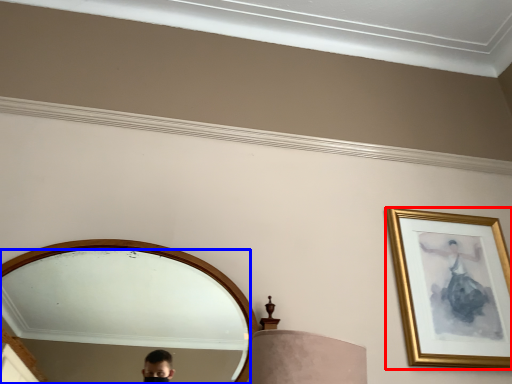
Question: Which object appears closest to the camera in this image, picture frame (highlighted by a red box) or mirror (highlighted by a blue box)?

Choices:
 (A) picture frame
 (B) mirror

Answer: (B)